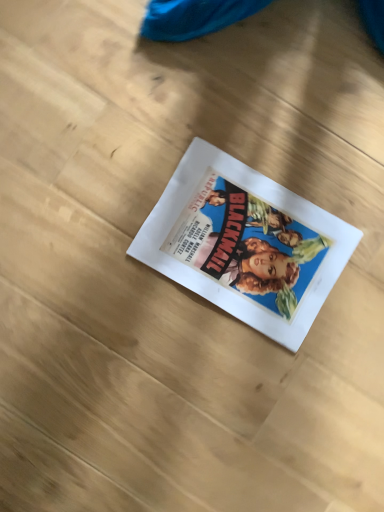
The image size is (384, 512). I want to click on white paper book at center, so click(245, 243).

What is the approximate height of white paper book at center?

It is 0.71 inches.

Describe the element at coordinates (245, 243) in the screenshot. The height and width of the screenshot is (512, 384). I see `white paper book at center` at that location.

Find the location of a particular element. The width and height of the screenshot is (384, 512). white paper book at center is located at coordinates (245, 243).